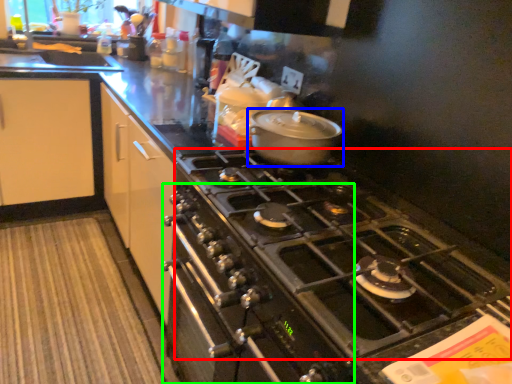
Question: Based on their relative distances, which object is farther from gas stove (highlighted by a red box)? Choose from kitchen appliance (highlighted by a blue box) and oven (highlighted by a green box).

Choices:
 (A) kitchen appliance
 (B) oven

Answer: (A)